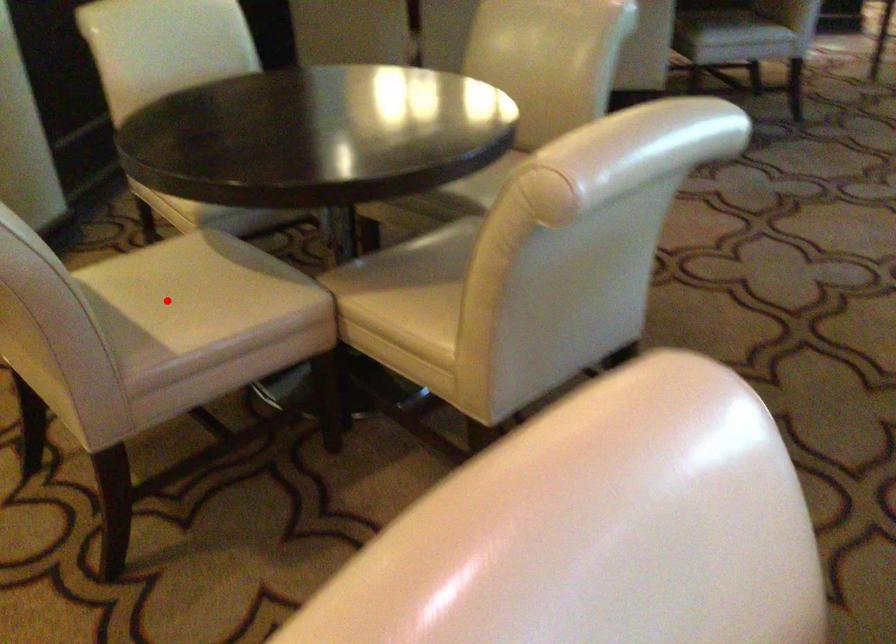
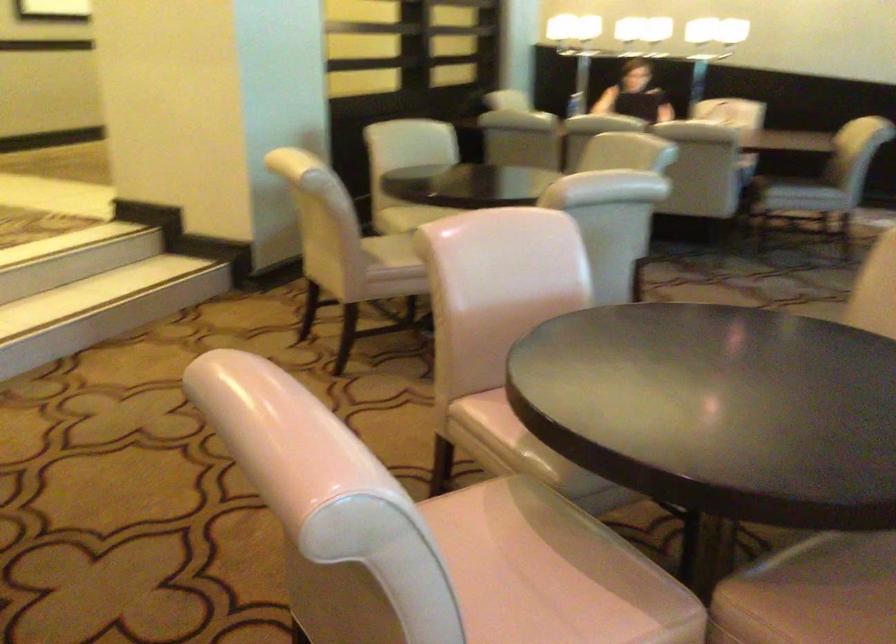
Question: I am providing you with two images of the same scene from different viewpoints. Given a red point in image1, look at the same physical point in image2. Is it:

Choices:
 (A) Closer to the viewpoint
 (B) Farther from the viewpoint

Answer: (B)